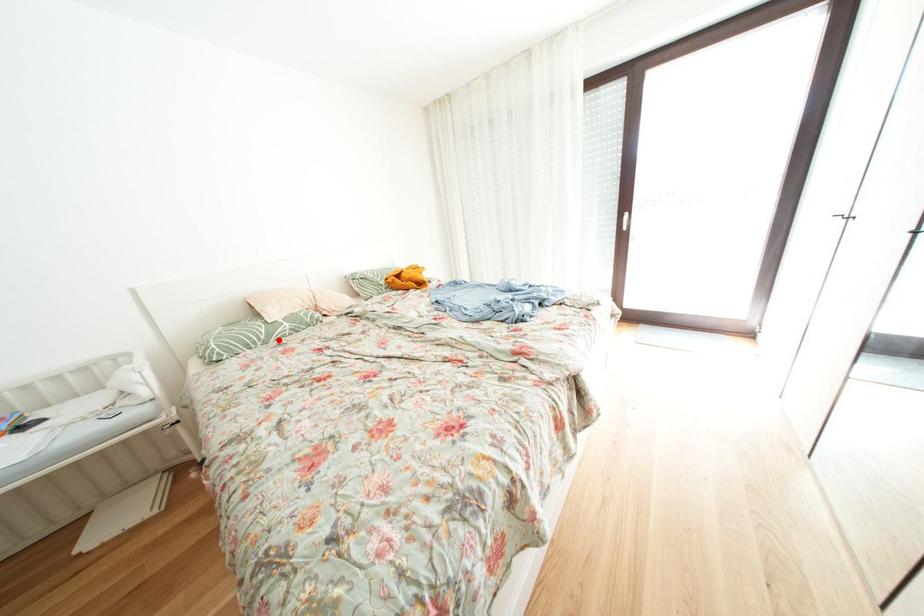
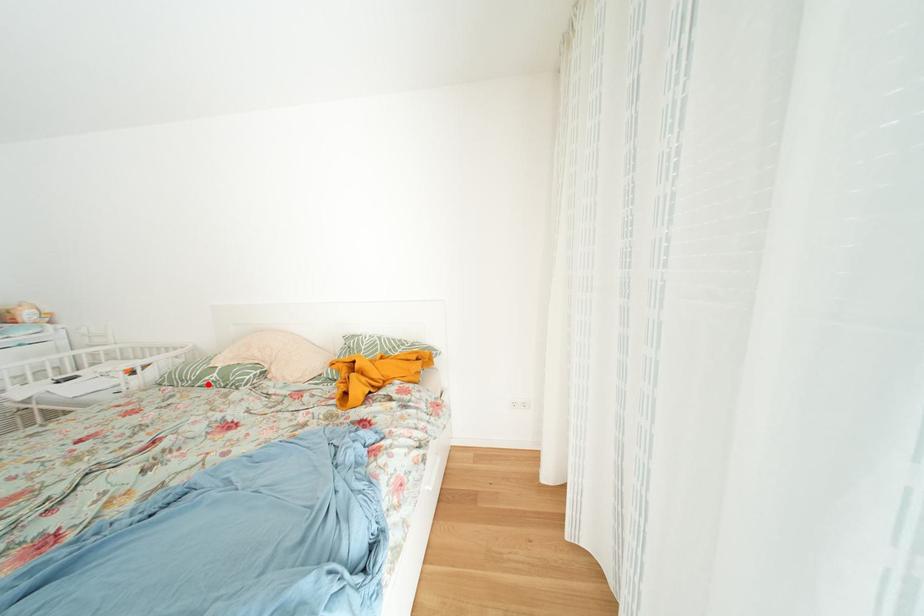
I am providing you with two images of the same scene from different viewpoints. A red point is marked on the first image and another point is marked on the second image. Do the highlighted points in image1 and image2 indicate the same real-world spot?

Yes